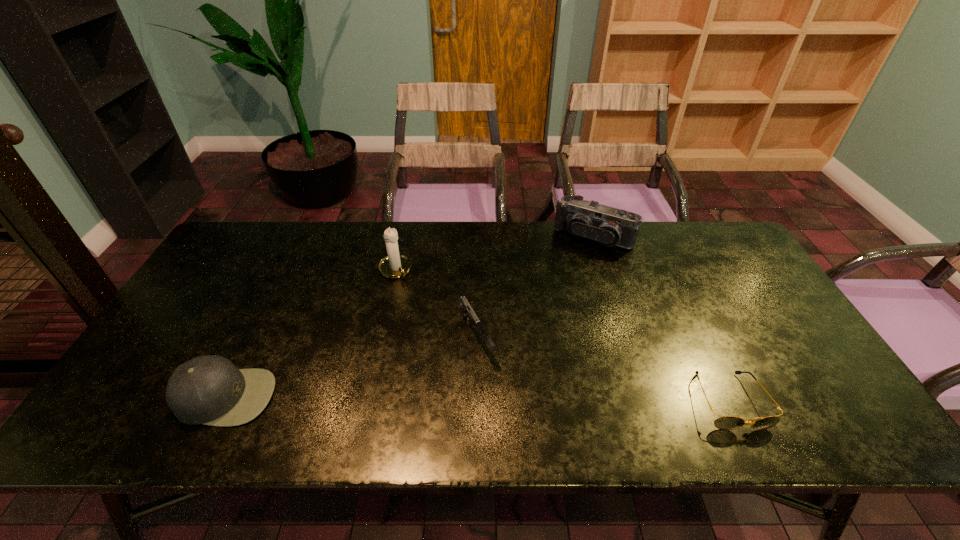
Locate an element on the screen. The height and width of the screenshot is (540, 960). free space on the desktop that is between the cap and the sunglasses and is positioned on the front-facing side of the camcorder is located at coordinates (492, 399).

Where is `vacant space on the desktop that is between the cap and the shortest object and is positioned on the handle side of the tallest object`? vacant space on the desktop that is between the cap and the shortest object and is positioned on the handle side of the tallest object is located at coordinates (491, 399).

You are a GUI agent. You are given a task and a screenshot of the screen. Output one action in this format:
    pyautogui.click(x=<x>, y=<y>)
    Task: Click on the vacant space on the desktop that is between the leftmost object and the sunglasses and is positioned at the muzzle end of the third object from right to left
    
    Given the screenshot: What is the action you would take?
    pyautogui.click(x=513, y=399)